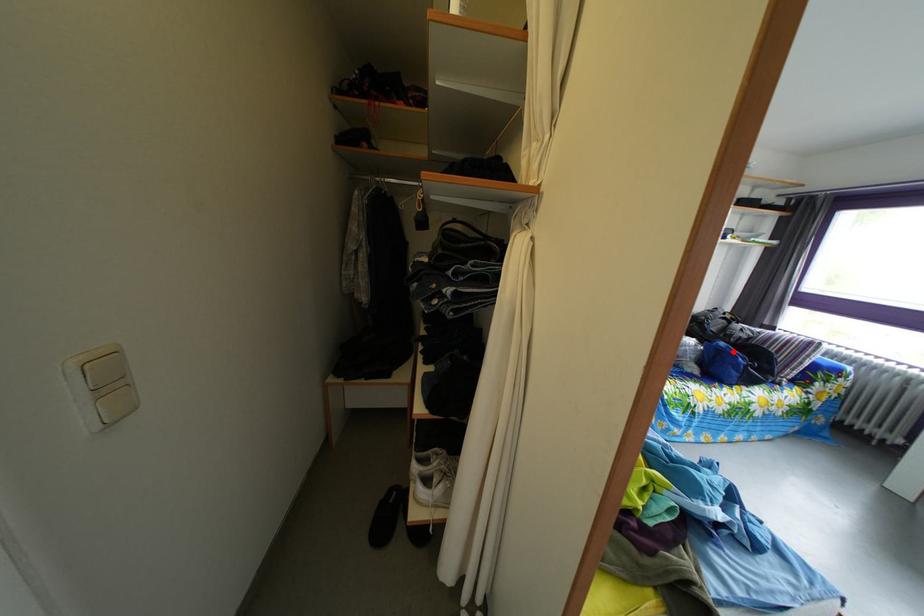
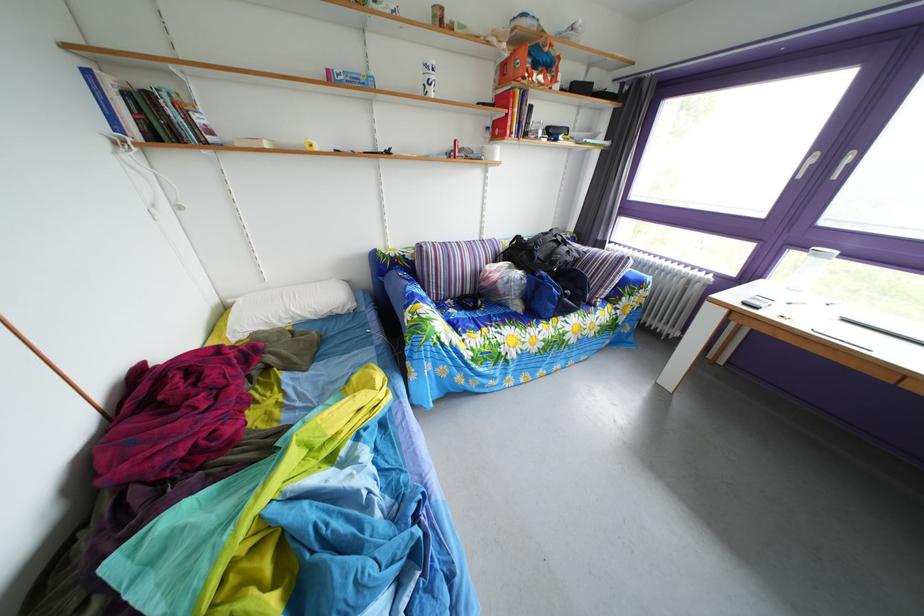
Locate, in the second image, the point that corresponds to the highlighted location in the first image.

(553, 282)